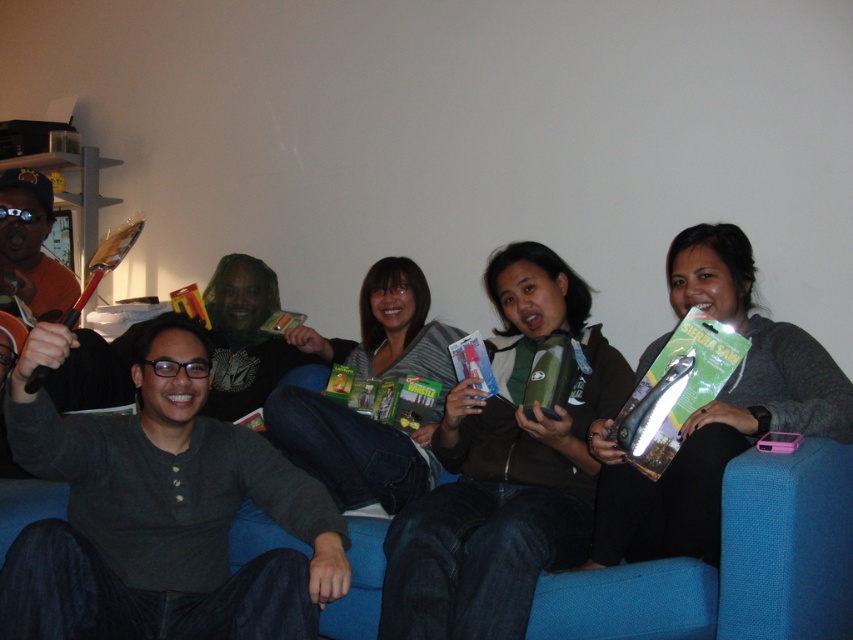
In the scene shown: Is green matte water bottle at center thinner than matte green box at center?

No, green matte water bottle at center is not thinner than matte green box at center.

Between point (476, 480) and point (387, 353), which one is positioned in front?

Point (476, 480) is more forward.

Locate an element on the screen. This screenshot has height=640, width=853. green matte water bottle at center is located at coordinates point(503,468).

Between matte gray sweater at center and matte green box at center, which one appears on the right side from the viewer's perspective?

From the viewer's perspective, matte gray sweater at center appears more on the right side.

Is matte gray sweater at center taller than matte green box at center?

Correct, matte gray sweater at center is much taller as matte green box at center.

Measure the distance between matte gray sweater at center and camera.

matte gray sweater at center and camera are 1.50 meters apart.

This screenshot has width=853, height=640. Find the location of `matte gray sweater at center`. matte gray sweater at center is located at coordinates (715, 412).

How far apart are matte green box at center and clear plastic survival saw at center?

They are 29.71 inches apart.

Between matte green box at center and clear plastic survival saw at center, which one is positioned higher?

clear plastic survival saw at center is higher up.

Is point (289, 394) farther from viewer compared to point (676, 445)?

Yes, it is behind point (676, 445).

What are the coordinates of `matte green box at center` in the screenshot? It's located at (364, 416).